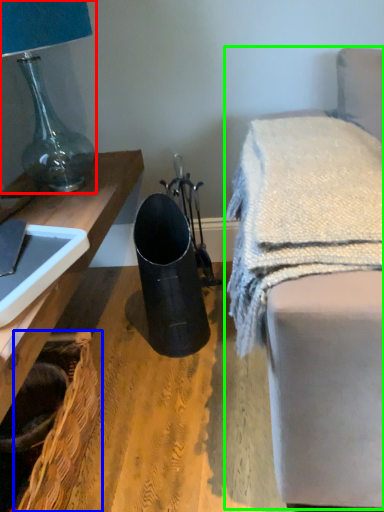
Question: Which object is the farthest from lamp (highlighted by a red box)? Choose among these: basket (highlighted by a blue box) or furniture (highlighted by a green box).

Choices:
 (A) basket
 (B) furniture

Answer: (B)